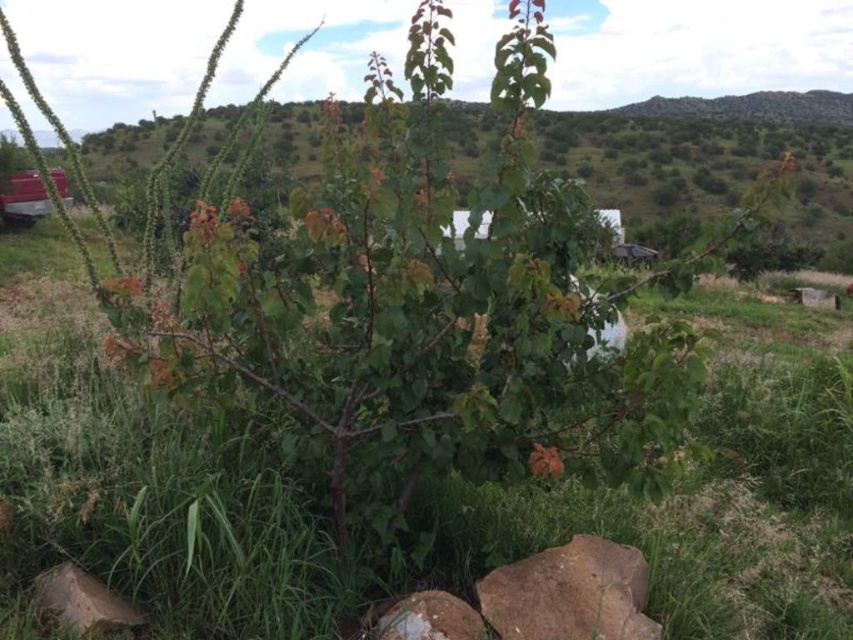
Question: Based on their relative distances, which object is nearer to the rusty metallic boulder at lower center?

Choices:
 (A) brown rough rock at lower center
 (B) brown rough boulder at lower left

Answer: (A)

Question: Is brown rough rock at lower center bigger than metallic red car at left?

Choices:
 (A) no
 (B) yes

Answer: (A)

Question: Considering the real-world distances, which object is closest to the brown rough rock at lower center?

Choices:
 (A) rusty metallic boulder at lower center
 (B) brown rough boulder at lower left
 (C) metallic red car at left

Answer: (A)

Question: Is brown rough boulder at lower left below rusty metallic boulder at lower center?

Choices:
 (A) yes
 (B) no

Answer: (B)

Question: Estimate the real-world distances between objects in this image. Which object is closer to the brown rough boulder at lower left?

Choices:
 (A) rusty metallic boulder at lower center
 (B) metallic red car at left

Answer: (A)

Question: Is brown rough rock at lower center positioned at the back of rusty metallic boulder at lower center?

Choices:
 (A) yes
 (B) no

Answer: (B)